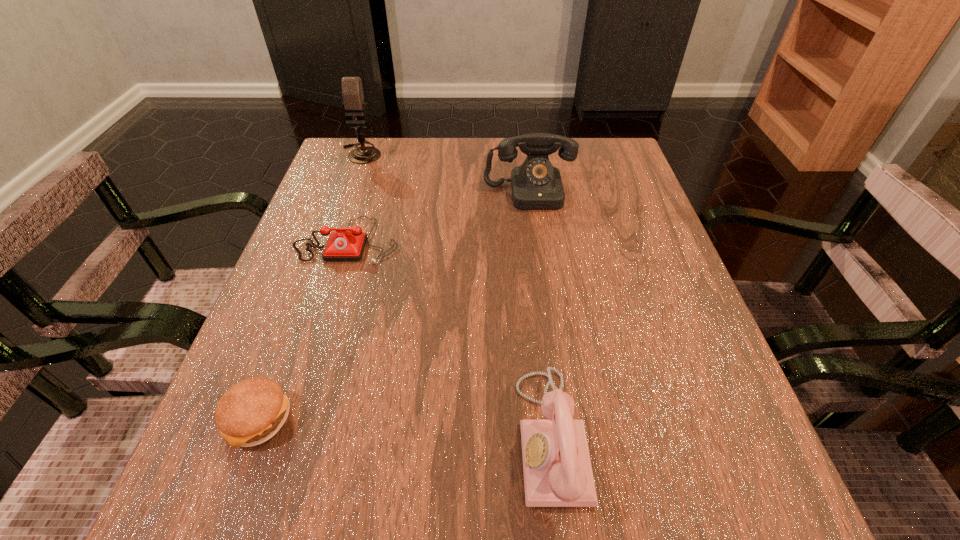
The width and height of the screenshot is (960, 540). What are the coordinates of `vacant area that lies between the fourth nearest object and the third tallest object` in the screenshot? It's located at (540, 314).

Locate an element on the screen. The width and height of the screenshot is (960, 540). unoccupied position between the nearest telephone and the farthest telephone is located at coordinates (540, 314).

Where is `empty space between the fourth nearest object and the farthest object`? The width and height of the screenshot is (960, 540). empty space between the fourth nearest object and the farthest object is located at coordinates (445, 173).

Locate an element on the screen. vacant region between the tallest object and the fourth nearest object is located at coordinates (445, 173).

Locate an element on the screen. vacant area that lies between the shortest telephone and the hamburger is located at coordinates (303, 329).

Where is `empty space that is in between the hamburger and the leftmost telephone`? This screenshot has width=960, height=540. empty space that is in between the hamburger and the leftmost telephone is located at coordinates (303, 329).

The height and width of the screenshot is (540, 960). Find the location of `vacant area that lies between the nearest telephone and the shortest telephone`. vacant area that lies between the nearest telephone and the shortest telephone is located at coordinates (450, 338).

The width and height of the screenshot is (960, 540). I want to click on unoccupied position between the second farthest telephone and the fourth nearest object, so click(x=439, y=217).

Find the location of a particular element. This screenshot has height=540, width=960. vacant space in between the third shortest object and the hamburger is located at coordinates (405, 427).

Identify the location of object that is the closest one to the farthest telephone. The image size is (960, 540). (342, 245).